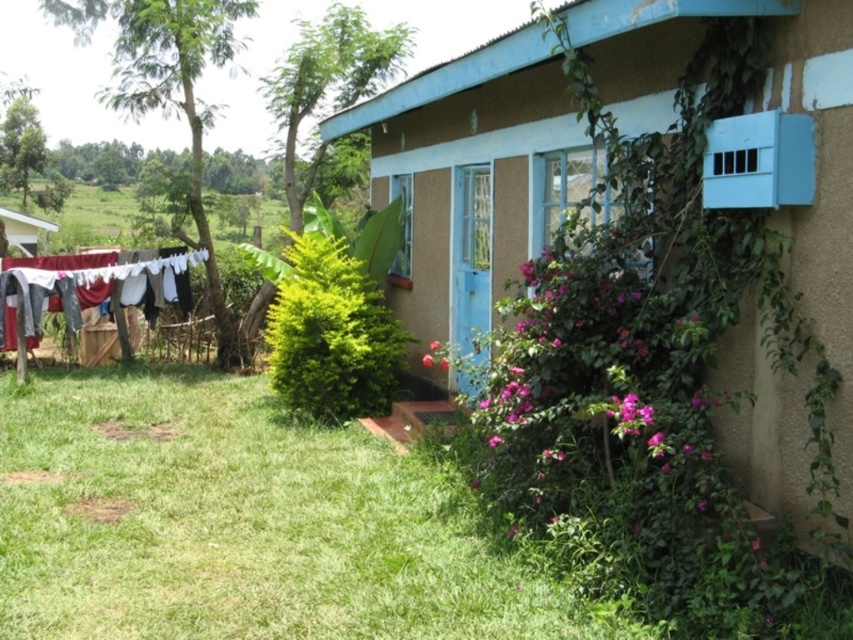
Is point (485, 621) farther from viewer compared to point (171, 264)?

No.

Identify the location of green grass at lower left. (238, 524).

Between point (833, 417) and point (45, 288), which one is positioned in front?

Point (833, 417) is more forward.

Consider the image. Does matte brown house at center have a smaller size compared to white fabric at left?

Yes, matte brown house at center is smaller than white fabric at left.

Between point (665, 138) and point (103, 272), which one is positioned behind?

Positioned behind is point (103, 272).

You are a GUI agent. You are given a task and a screenshot of the screen. Output one action in this format:
    pyautogui.click(x=<x>, y=<y>)
    Task: Click on the matte brown house at center
    The image size is (853, 640).
    Given the screenshot: What is the action you would take?
    pyautogui.click(x=761, y=218)

Based on the photo, which is more to the right, green grass at lower left or matte brown house at center?

Positioned to the right is matte brown house at center.

Does point (21, 588) lie behind point (753, 96)?

Yes, point (21, 588) is farther from viewer.

Does point (325, 624) come behind point (837, 54)?

That is True.

Identify the location of green grass at lower left. This screenshot has width=853, height=640. (238, 524).